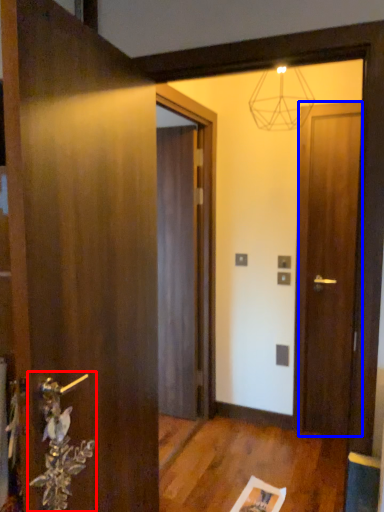
Question: Which object is closer to the camera taking this photo, door handle (highlighted by a red box) or door (highlighted by a blue box)?

Choices:
 (A) door handle
 (B) door

Answer: (A)